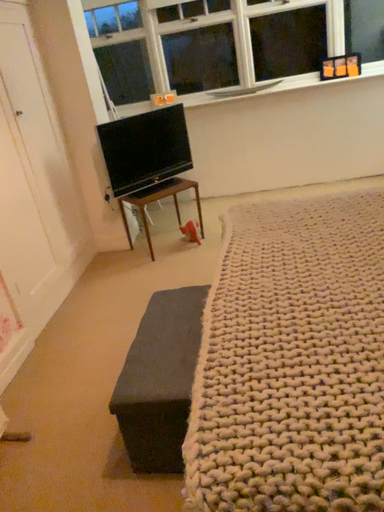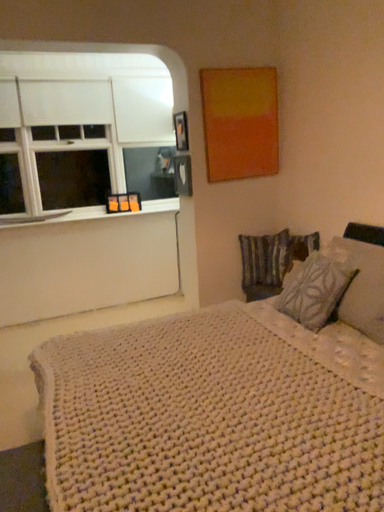
Question: How did the camera likely rotate when shooting the video?

Choices:
 (A) rotated downward
 (B) rotated upward

Answer: (B)